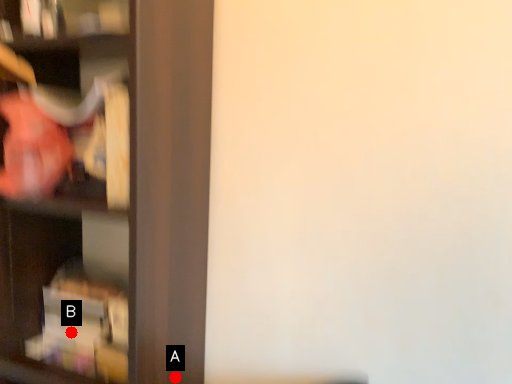
Question: Two points are circled on the image, labeled by A and B beside each circle. Among these points, which one is farthest from the camera?

Choices:
 (A) A is further
 (B) B is further

Answer: (B)